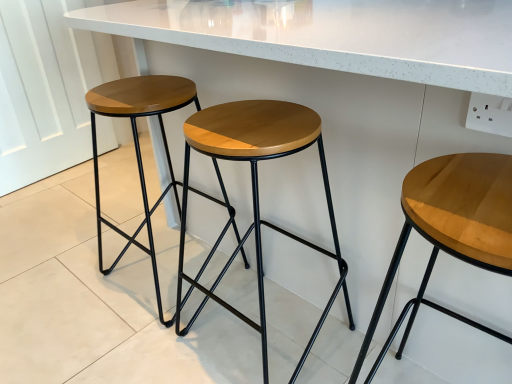
Where is `vacant space that's between wooden seat at center, which ranks as the 1th stool in left-to-right order, and wooden/matte stool at center, positioned as the second stool in left-to-right order`? This screenshot has width=512, height=384. vacant space that's between wooden seat at center, which ranks as the 1th stool in left-to-right order, and wooden/matte stool at center, positioned as the second stool in left-to-right order is located at coordinates (212, 307).